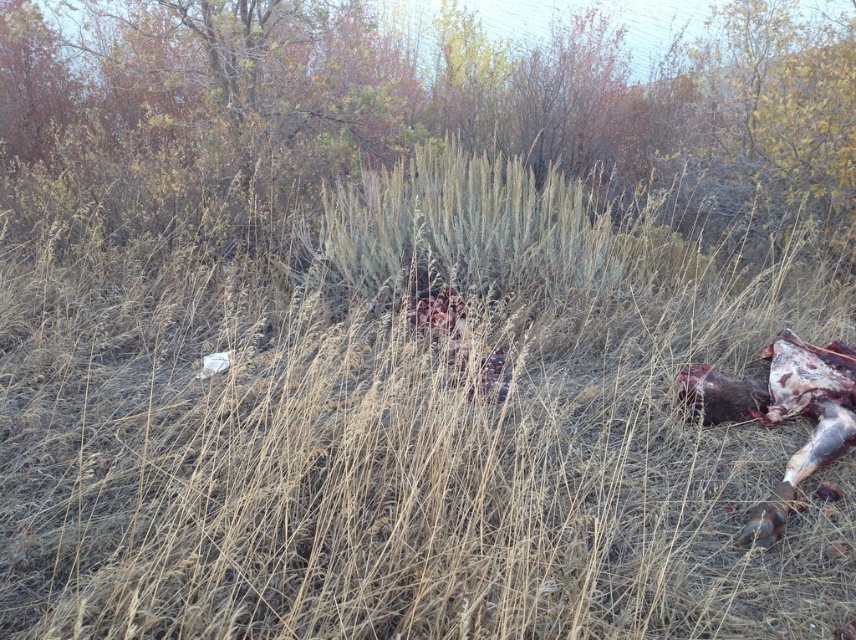
Can you confirm if green grass at center is positioned to the right of brown fur animal at lower right?

In fact, green grass at center is to the left of brown fur animal at lower right.

Describe the element at coordinates (438, 106) in the screenshot. I see `green grass at center` at that location.

Locate an element on the screen. The height and width of the screenshot is (640, 856). green grass at center is located at coordinates (438, 106).